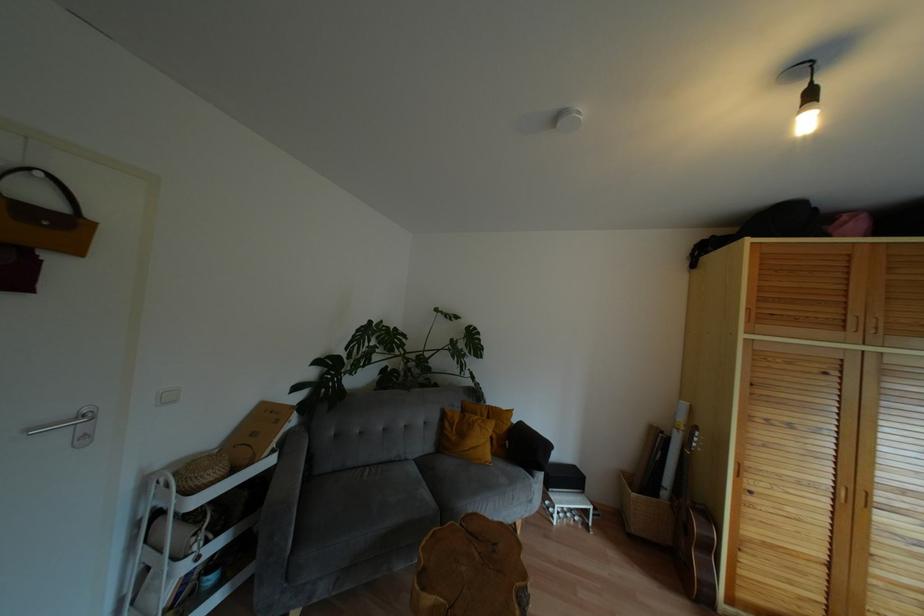
Where is `grey sofa armrest`? Image resolution: width=924 pixels, height=616 pixels. grey sofa armrest is located at coordinates (292, 467).